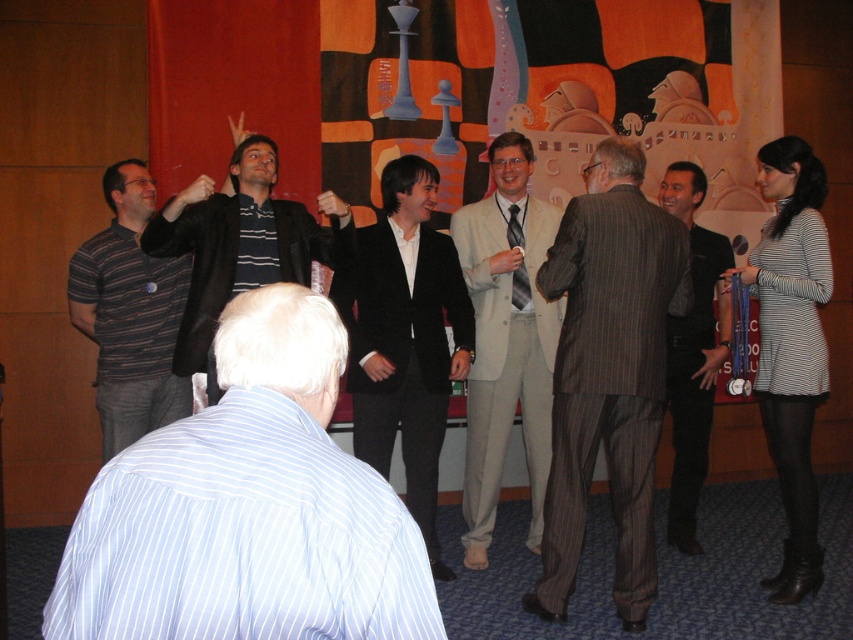
You are a photographer at the event and want to take a photo that includes both the blue striped shirt at lower left and the black striped sweater at upper center. Which one should you focus on first to ensure both are in focus?

You should focus on the blue striped shirt at lower left first because it is closer to the viewer than the black striped sweater at upper center. By focusing on the closer object, the farther one will also be in focus due to the depth of field.

You are organizing a photo shoot and need to place two mannequins wearing the light beige suit at center and the black striped sweater at upper center. The mannequin for the light beige suit must be smaller than the one for the black striped sweater. Which mannequin should you place first if you want to follow the size requirement?

The light beige suit at center is smaller than the black striped sweater at upper center, so you should place the mannequin for the light beige suit at center first to ensure it is smaller than the one for the black striped sweater at upper center.

You are organizing a photo shoot and need to place two models in the scene described. The first model should wear the light beige suit at center, and the second model should wear the black striped sweater at upper center. According to the scene description, where should you position the second model relative to the first?

The light beige suit at center is positioned on the right side of the black striped sweater at upper center, so the second model wearing the black striped sweater at upper center should be placed to the left of the first model in the light beige suit at center.